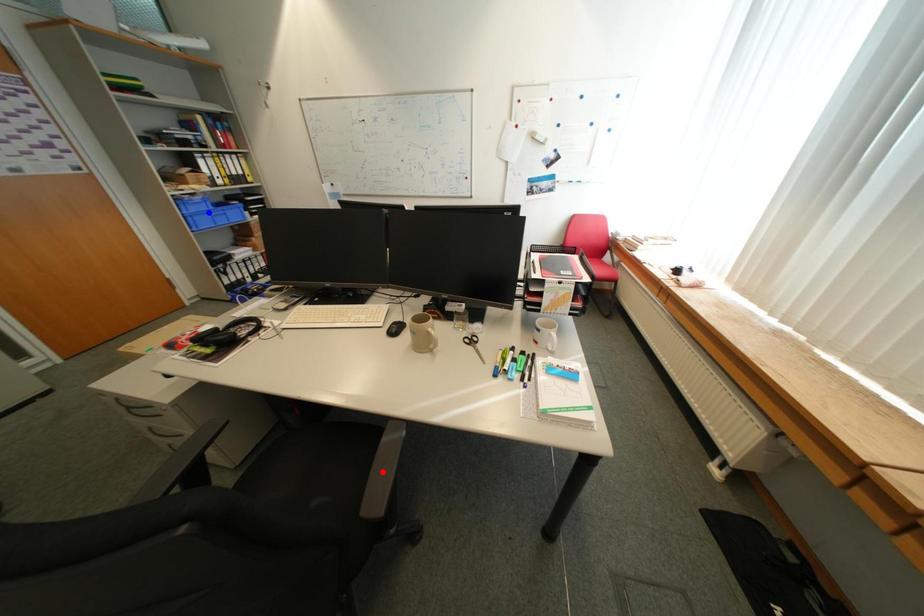
Question: Which of the two points in the image is closer to the camera?

Choices:
 (A) Blue point is closer.
 (B) Red point is closer.

Answer: (B)